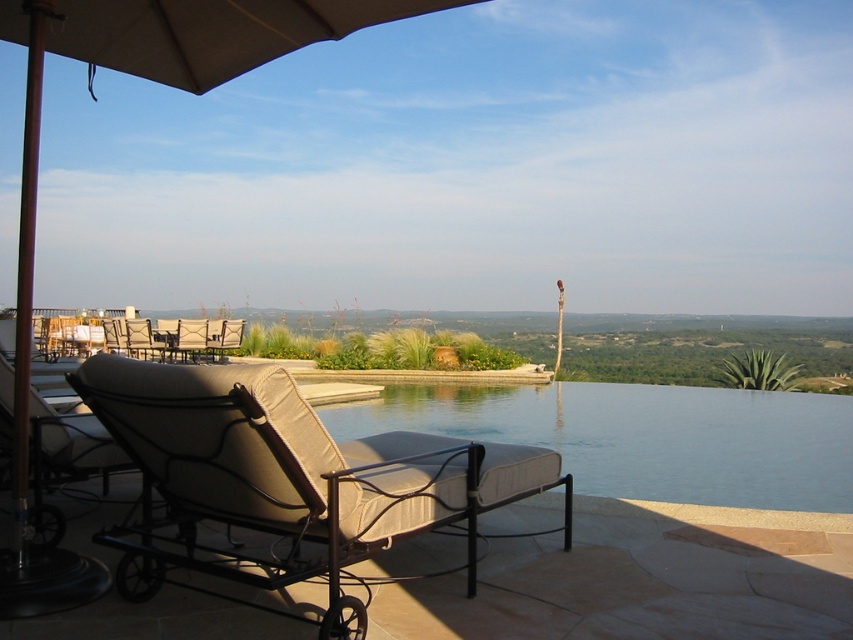
Can you confirm if beige fabric chair at upper left is bigger than beige fabric chair at center?

Yes, beige fabric chair at upper left is bigger than beige fabric chair at center.

Image resolution: width=853 pixels, height=640 pixels. What are the coordinates of `beige fabric chair at upper left` in the screenshot? It's located at (144, 339).

Between point (144, 348) and point (200, 326), which one is positioned in front?

Point (144, 348) is more forward.

Image resolution: width=853 pixels, height=640 pixels. Identify the location of beige fabric chair at upper left. (144, 339).

Between beige fabric chaise lounge at lower left and beige fabric chair at lower left, which one has more height?

Standing taller between the two is beige fabric chaise lounge at lower left.

Does beige fabric chaise lounge at lower left appear under beige fabric chair at lower left?

Correct, beige fabric chaise lounge at lower left is located below beige fabric chair at lower left.

This screenshot has width=853, height=640. What are the coordinates of `beige fabric chaise lounge at lower left` in the screenshot? It's located at (286, 477).

Can you confirm if beige fabric chaise lounge at lower left is wider than clear glass water at center?

In fact, beige fabric chaise lounge at lower left might be narrower than clear glass water at center.

Can you confirm if beige fabric chaise lounge at lower left is positioned to the right of clear glass water at center?

Incorrect, beige fabric chaise lounge at lower left is not on the right side of clear glass water at center.

Which is behind, point (425, 444) or point (792, 500)?

Positioned behind is point (792, 500).

Locate an element on the screen. The image size is (853, 640). beige fabric chaise lounge at lower left is located at coordinates (286, 477).